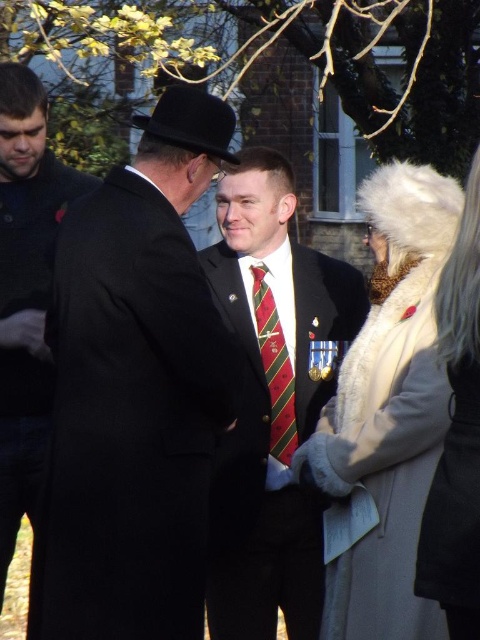
Can you confirm if fur coat at center is positioned to the right of red striped tie at center?

Yes, fur coat at center is to the right of red striped tie at center.

What do you see at coordinates (386, 417) in the screenshot? This screenshot has height=640, width=480. I see `fur coat at center` at bounding box center [386, 417].

In order to click on fur coat at center in this screenshot , I will do `click(386, 417)`.

Which is above, fur coat at center or black felt fedora at center?

black felt fedora at center

Can you confirm if fur coat at center is positioned below black felt fedora at center?

Yes, fur coat at center is below black felt fedora at center.

Consider the image. Who is more distant from viewer, (x=354, y=340) or (x=211, y=136)?

Positioned behind is point (x=354, y=340).

In order to click on fur coat at center in this screenshot , I will do `click(386, 417)`.

Is matte black coat at center wider than red striped tie at center?

Correct, the width of matte black coat at center exceeds that of red striped tie at center.

Measure the distance between point (156,540) and camera.

They are 5.39 meters apart.

Where is `matte black coat at center`? The width and height of the screenshot is (480, 640). matte black coat at center is located at coordinates [x=134, y=392].